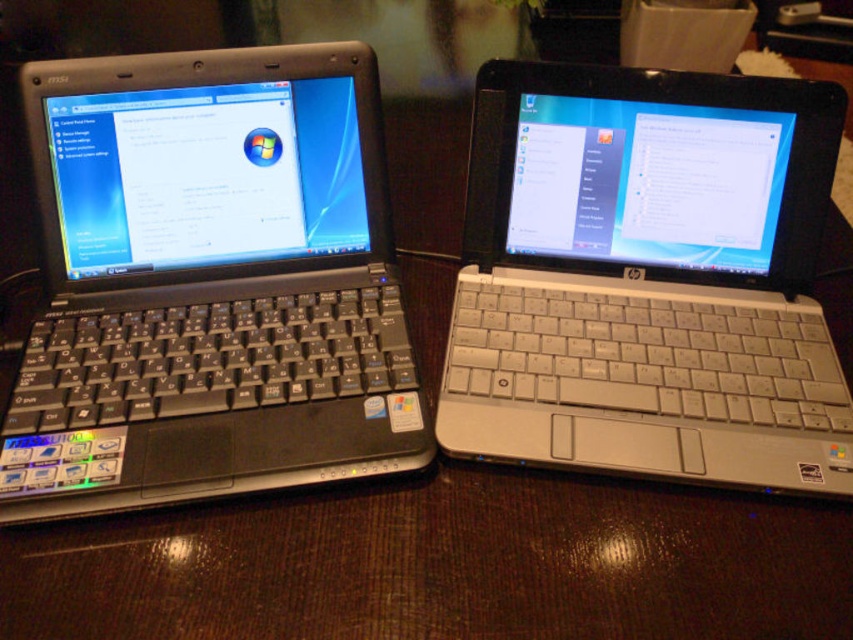
Between matte black laptop at left and silver matte laptop at center, which one appears on the right side from the viewer's perspective?

Positioned to the right is silver matte laptop at center.

Is matte black laptop at left positioned at the back of silver matte laptop at center?

No.

What do you see at coordinates (207, 282) in the screenshot? The image size is (853, 640). I see `matte black laptop at left` at bounding box center [207, 282].

Locate an element on the screen. matte black laptop at left is located at coordinates (207, 282).

Is silver matte laptop at center to the right of black plastic table at center from the viewer's perspective?

Yes, silver matte laptop at center is to the right of black plastic table at center.

Which is behind, point (758, 380) or point (569, 552)?

Positioned behind is point (758, 380).

You are a GUI agent. You are given a task and a screenshot of the screen. Output one action in this format:
    pyautogui.click(x=<x>, y=<y>)
    Task: Click on the silver matte laptop at center
    Image resolution: width=853 pixels, height=640 pixels.
    Given the screenshot: What is the action you would take?
    [647, 276]

Who is taller, matte black laptop at left or black plastic table at center?

With more height is matte black laptop at left.

Which is behind, point (152, 380) or point (173, 593)?

The point (152, 380) is behind.

In order to click on matte black laptop at left in this screenshot , I will do `click(207, 282)`.